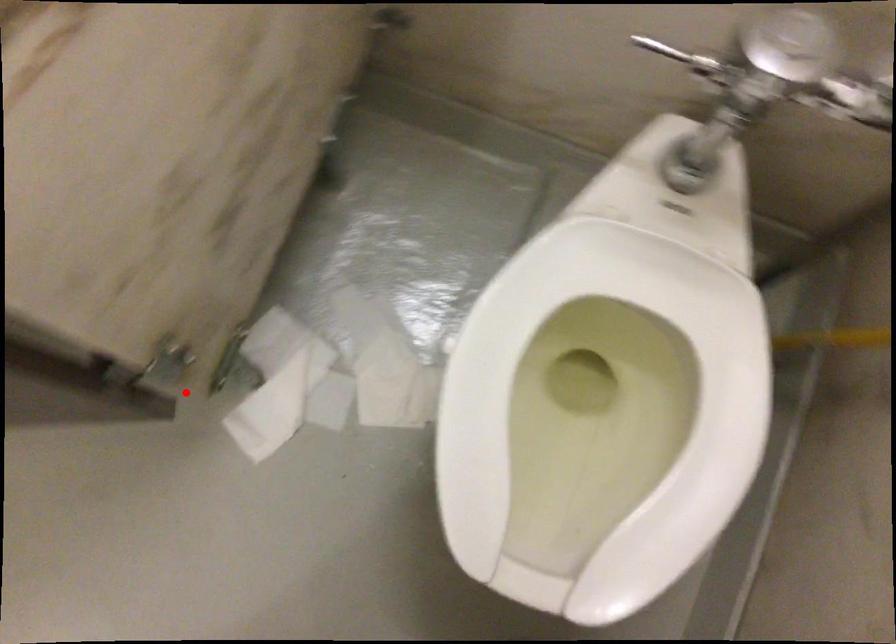
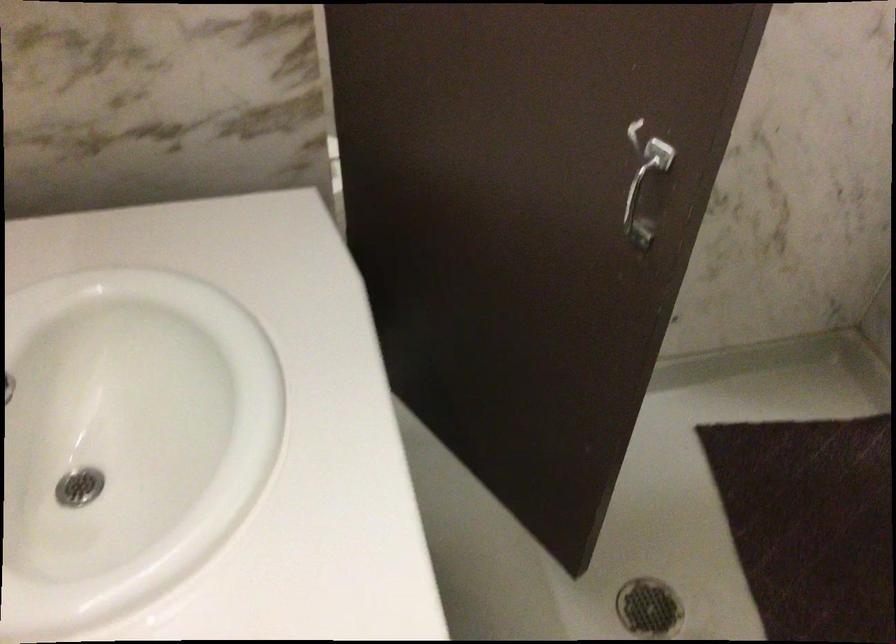
Question: I am providing you with two images of the same scene from different viewpoints. A red point is marked on the first image. At the location where the point appears in image 1, is it still visible in image 2?

Choices:
 (A) Yes
 (B) No

Answer: (B)